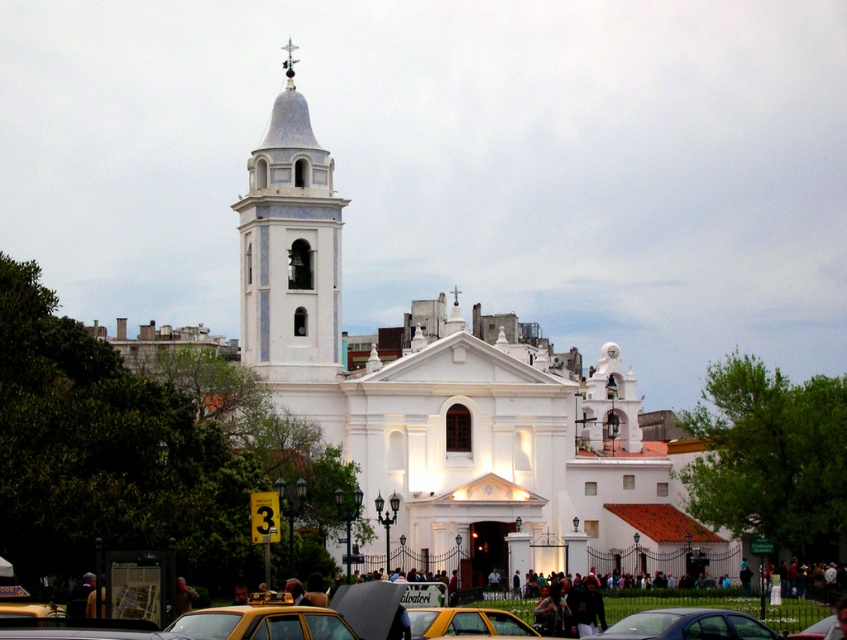
Does point (273, 244) lie in front of point (418, 632)?

No, (273, 244) is further to viewer.

Is white stucco bell tower at upper left smaller than yellow matte taxi at lower center?

No, white stucco bell tower at upper left is not smaller than yellow matte taxi at lower center.

Does point (259, 317) lie in front of point (485, 611)?

No, (259, 317) is further to viewer.

Find the location of a particular element. white stucco bell tower at upper left is located at coordinates (291, 248).

Which is below, yellow rubber taxi at lower center or yellow matte taxi at lower center?

yellow matte taxi at lower center is lower down.

Is yellow rubber taxi at lower center positioned in front of yellow matte taxi at lower center?

Yes, it is.

Locate an element on the screen. Image resolution: width=847 pixels, height=640 pixels. yellow rubber taxi at lower center is located at coordinates (263, 620).

Can you confirm if yellow rubber taxi at lower center is positioned to the right of metallic silver car at center?

Incorrect, yellow rubber taxi at lower center is not on the right side of metallic silver car at center.

Does yellow rubber taxi at lower center have a smaller size compared to metallic silver car at center?

Yes.

Image resolution: width=847 pixels, height=640 pixels. Describe the element at coordinates (263, 620) in the screenshot. I see `yellow rubber taxi at lower center` at that location.

The width and height of the screenshot is (847, 640). Find the location of `yellow rubber taxi at lower center`. yellow rubber taxi at lower center is located at coordinates (263, 620).